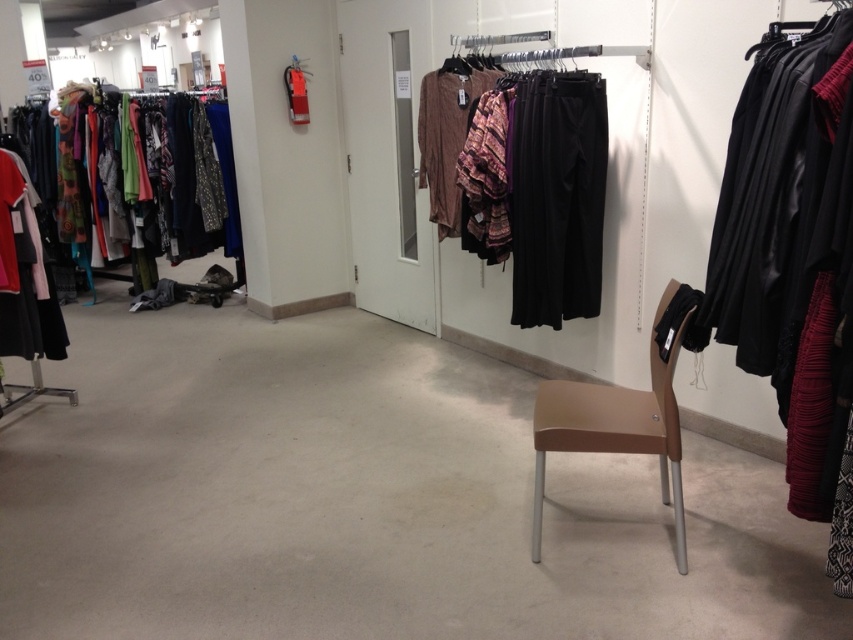
You are a customer holding a shopping bag and want to exit the store through the door in the center. The store has a policy that requires customers to pass through a security gate located between the two objects mentioned. Can you determine if the distance between the black leather jacket at right and the matte black dress at left is sufficient for the security gate to be placed between them?

The black leather jacket at right and the matte black dress at left are 3.12 meters apart from each other. The security gate typically requires a minimum of 2 meters of space to function properly. Since the distance between them is more than enough, the security gate can be placed between the black leather jacket at right and the matte black dress at left.

You are a customer in a clothing store holding a shopping bag. You see the matte black pants at center and the black leather jacket at right. Which item has a wider width?

The matte black pants at center has a larger width than the black leather jacket at right according to the description.

You are a customer in a clothing store and you want to hang a new hanger between the black leather jacket at right and the matte black dress at left. Which object should you place the new hanger closer to if you want it to be higher?

The black leather jacket at right has a greater height compared to the matte black dress at left, so you should place the new hanger closer to the black leather jacket at right to achieve a higher placement.